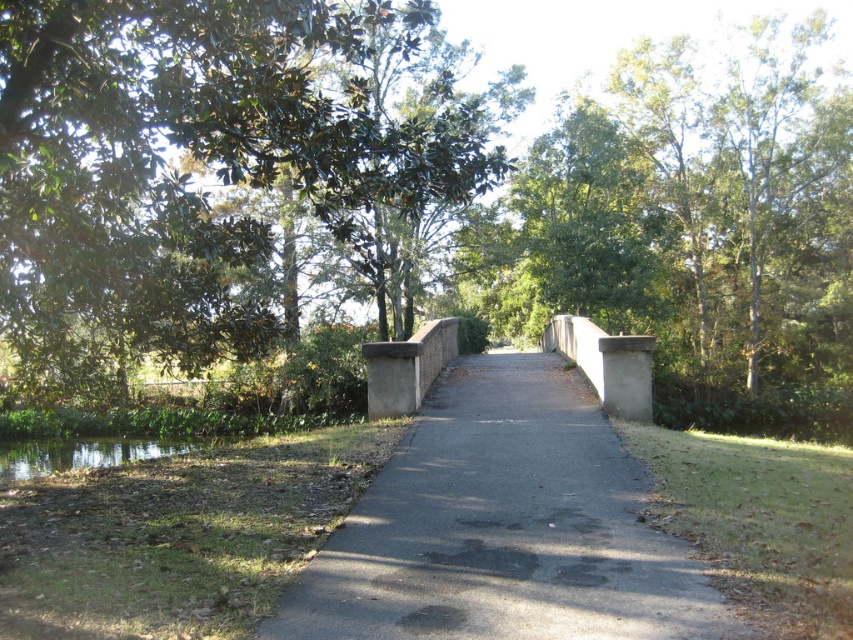
Question: Is green leafy tree at upper left positioned behind green reflective water at lower left?

Choices:
 (A) no
 (B) yes

Answer: (A)

Question: Can you confirm if green leafy tree at upper left is wider than green reflective water at lower left?

Choices:
 (A) no
 (B) yes

Answer: (B)

Question: Which object is farther from the camera taking this photo?

Choices:
 (A) gray asphalt pavement at center
 (B) green reflective water at lower left

Answer: (B)

Question: Which point is closer to the camera?

Choices:
 (A) green leafy tree at upper left
 (B) green reflective water at lower left
 (C) gray asphalt pavement at center

Answer: (C)

Question: Which point appears farthest from the camera in this image?

Choices:
 (A) (109, 438)
 (B) (22, 252)

Answer: (A)

Question: Observing the image, what is the correct spatial positioning of green leafy tree at upper left in reference to gray asphalt pavement at center?

Choices:
 (A) above
 (B) below

Answer: (A)